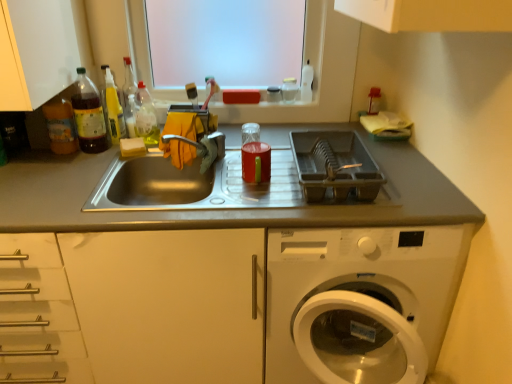
Where is `free space in front of translucent plastic bottle at left, the third bottle from the left`? free space in front of translucent plastic bottle at left, the third bottle from the left is located at coordinates (93, 156).